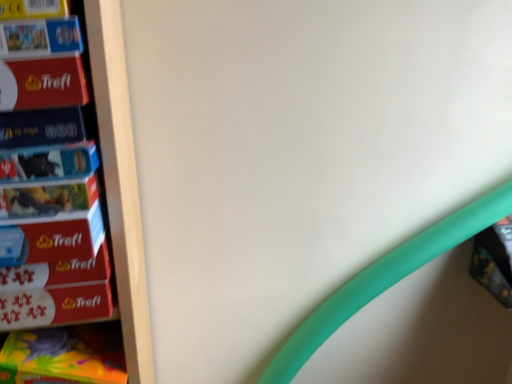
Question: Can you confirm if matte black book at left, which is the 1th paperback book in bottom-to-top order, is shorter than matte red puzzle box at left, the 1th paperback book from the top?

Choices:
 (A) yes
 (B) no

Answer: (A)

Question: Is matte black book at left, placed as the third paperback book when sorted from top to bottom, to the right of matte red puzzle box at left, the 1th paperback book from the top, from the viewer's perspective?

Choices:
 (A) no
 (B) yes

Answer: (B)

Question: Does matte black book at left, placed as the third paperback book when sorted from top to bottom, have a smaller size compared to matte red puzzle box at left, positioned as the third paperback book in bottom-to-top order?

Choices:
 (A) no
 (B) yes

Answer: (B)

Question: Is matte black book at left, placed as the third paperback book when sorted from top to bottom, positioned beyond the bounds of matte red puzzle box at left, positioned as the third paperback book in bottom-to-top order?

Choices:
 (A) no
 (B) yes

Answer: (B)

Question: Would you say matte red puzzle box at left, positioned as the third paperback book in bottom-to-top order, is part of matte black book at left, which is the 1th paperback book in bottom-to-top order,'s contents?

Choices:
 (A) no
 (B) yes

Answer: (A)

Question: In the image, is matte cardboard book at left, the second paperback book in the bottom-to-top sequence, on the left side or the right side of matte red puzzle box at left, the 1th paperback book from the top?

Choices:
 (A) left
 (B) right

Answer: (B)

Question: Do you think matte cardboard book at left, the second paperback book in the bottom-to-top sequence, is within matte red puzzle box at left, positioned as the third paperback book in bottom-to-top order, or outside of it?

Choices:
 (A) outside
 (B) inside

Answer: (A)

Question: Considering their positions, is matte cardboard book at left, the second paperback book positioned from the top, located in front of or behind matte red puzzle box at left, positioned as the third paperback book in bottom-to-top order?

Choices:
 (A) front
 (B) behind

Answer: (B)

Question: From the image's perspective, is matte cardboard book at left, the second paperback book positioned from the top, located above or below matte red puzzle box at left, positioned as the third paperback book in bottom-to-top order?

Choices:
 (A) below
 (B) above

Answer: (A)

Question: From the image's perspective, is matte cardboard book at upper left, the 2th book from the bottom, located above or below matte cardboard book at left, the second paperback book in the bottom-to-top sequence?

Choices:
 (A) below
 (B) above

Answer: (B)

Question: Is matte cardboard book at upper left, which ranks as the first book in front-to-back order, taller or shorter than matte cardboard book at left, the second paperback book in the bottom-to-top sequence?

Choices:
 (A) tall
 (B) short

Answer: (A)

Question: Based on their positions, is matte cardboard book at upper left, which ranks as the first book in front-to-back order, located to the left or right of matte cardboard book at left, the second paperback book positioned from the top?

Choices:
 (A) left
 (B) right

Answer: (A)

Question: From a real-world perspective, relative to matte cardboard book at left, the second paperback book positioned from the top, is matte cardboard book at upper left, the 2th book from the bottom, vertically above or below?

Choices:
 (A) above
 (B) below

Answer: (A)

Question: In terms of size, does matte plastic book at right, the first book viewed from the back, appear bigger or smaller than matte cardboard book at left, the second paperback book positioned from the top?

Choices:
 (A) big
 (B) small

Answer: (A)

Question: Is matte plastic book at right, the first book viewed from the back, in front of or behind matte cardboard book at left, the second paperback book in the bottom-to-top sequence, in the image?

Choices:
 (A) front
 (B) behind

Answer: (B)